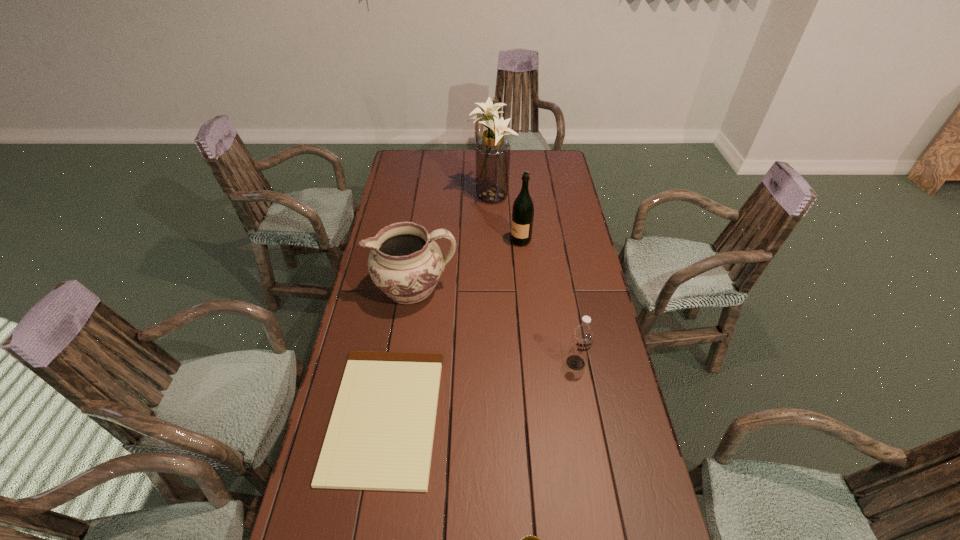
You are a GUI agent. You are given a task and a screenshot of the screen. Output one action in this format:
    pyautogui.click(x=<x>, y=<y>)
    Task: Click on the vacant space situated on the front-facing side of the fifth nearest object
    The image size is (960, 540).
    Given the screenshot: What is the action you would take?
    pyautogui.click(x=454, y=240)

Locate an element on the screen. The image size is (960, 540). vacant point located on the front-facing side of the fifth nearest object is located at coordinates (493, 240).

Where is `vacant space located 0.190m on the front-facing side of the fifth nearest object`? vacant space located 0.190m on the front-facing side of the fifth nearest object is located at coordinates (464, 240).

Where is `vacant space situated 0.100m on the front label of the vodka`? The image size is (960, 540). vacant space situated 0.100m on the front label of the vodka is located at coordinates (583, 402).

Locate an element on the screen. The width and height of the screenshot is (960, 540). blank space located on the right of the shortest object is located at coordinates (464, 415).

Identify the location of pitcher that is positioned at the left edge. The image size is (960, 540). (405, 263).

Locate an element on the screen. The width and height of the screenshot is (960, 540). clipboard that is at the left edge is located at coordinates (380, 437).

Locate an element on the screen. object at the right edge is located at coordinates (582, 335).

Identify the location of vacant space at the far edge of the desktop. (459, 163).

The width and height of the screenshot is (960, 540). Identify the location of vacant space at the left edge of the desktop. (421, 183).